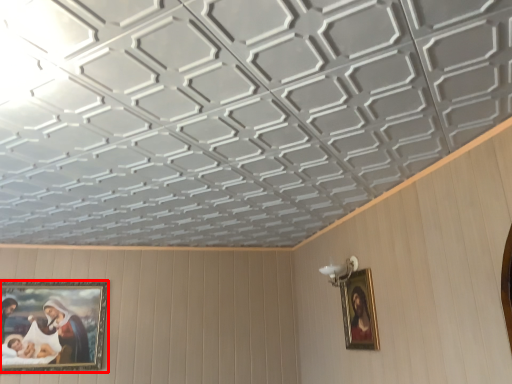
Question: From the image's perspective, what is the correct spatial positioning of picture frame (annotated by the red box) in reference to picture frame?

Choices:
 (A) below
 (B) above

Answer: (A)